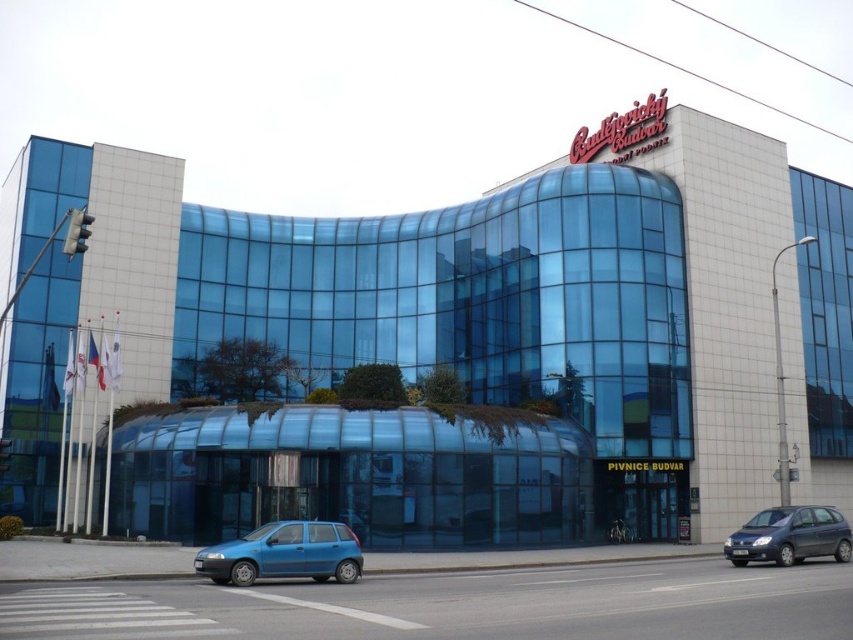
Question: Which point is farther to the camera?

Choices:
 (A) (380, 486)
 (B) (328, 524)

Answer: (A)

Question: Among these objects, which one is nearest to the camera?

Choices:
 (A) transparent glass building at center
 (B) dark gray metallic hatchback at lower right
 (C) matte blue hatchback at center

Answer: (C)

Question: Is matte blue hatchback at center wider than dark gray metallic hatchback at lower right?

Choices:
 (A) no
 (B) yes

Answer: (A)

Question: Which point appears farthest from the camera in this image?

Choices:
 (A) pyautogui.click(x=799, y=545)
 (B) pyautogui.click(x=132, y=330)

Answer: (B)

Question: Can you confirm if matte blue hatchback at center is thinner than dark gray metallic hatchback at lower right?

Choices:
 (A) yes
 (B) no

Answer: (A)

Question: Does transparent glass building at center have a greater width compared to matte blue hatchback at center?

Choices:
 (A) yes
 (B) no

Answer: (A)